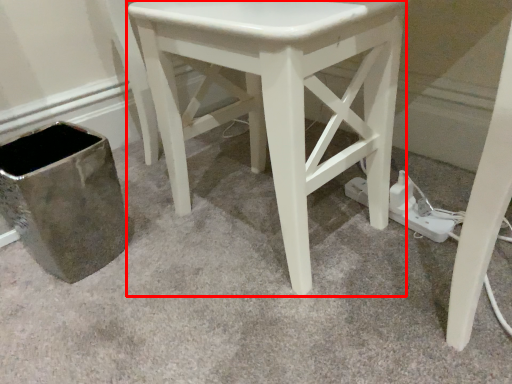
Question: From the image's perspective, where is stool (annotated by the red box) located in relation to plug in the image?

Choices:
 (A) above
 (B) below

Answer: (A)